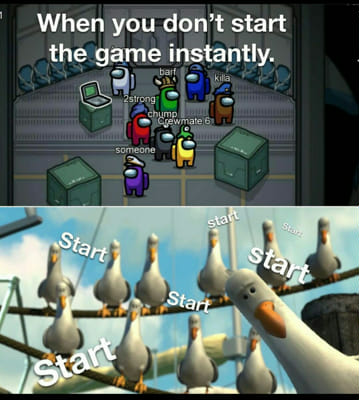
I want to click on door, so click(x=166, y=41), click(x=143, y=40).